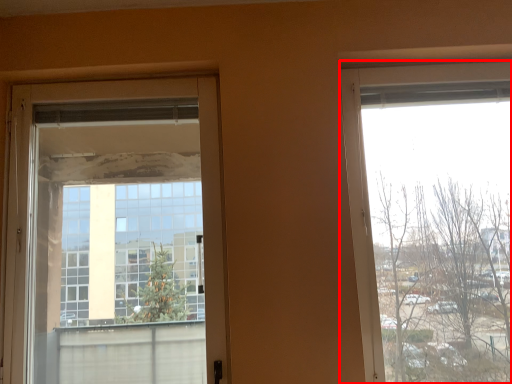
Question: Considering the relative positions of window (annotated by the red box) and door in the image provided, where is window (annotated by the red box) located with respect to the staircase?

Choices:
 (A) right
 (B) left

Answer: (A)